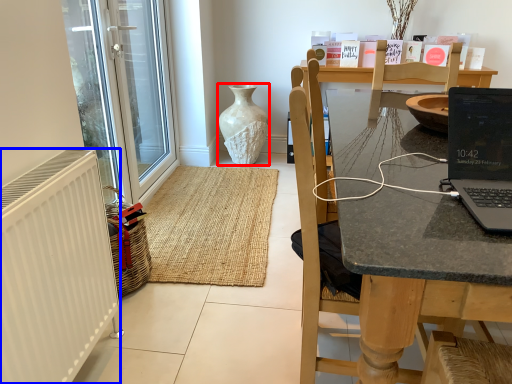
Question: Among these objects, which one is farthest to the camera, vase (highlighted by a red box) or radiator (highlighted by a blue box)?

Choices:
 (A) vase
 (B) radiator

Answer: (A)